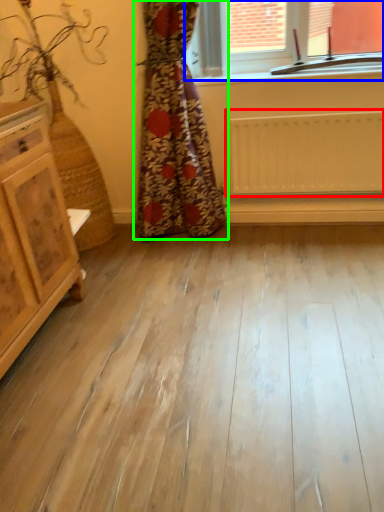
Question: Estimate the real-world distances between objects in this image. Which object is closer to radiator (highlighted by a red box), window (highlighted by a blue box) or curtain (highlighted by a green box)?

Choices:
 (A) window
 (B) curtain

Answer: (B)